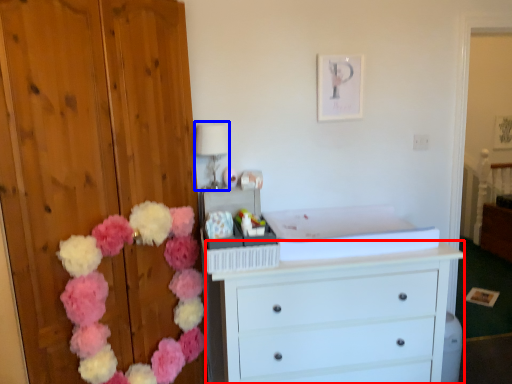
Question: Which point is closer to the camera, chest of drawers (highlighted by a red box) or lamp (highlighted by a blue box)?

Choices:
 (A) chest of drawers
 (B) lamp

Answer: (A)